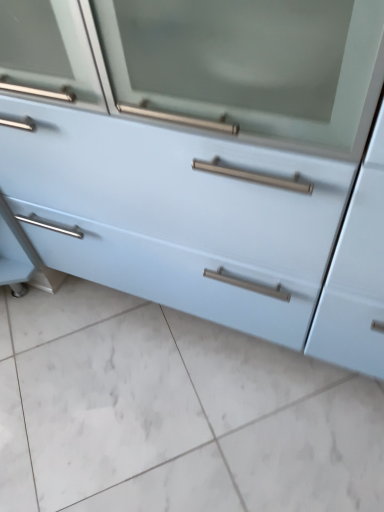
Question: From the image's perspective, relative to white glossy tile at lower center, is light blue matte cabinet at center above or below?

Choices:
 (A) above
 (B) below

Answer: (A)

Question: From a real-world perspective, is light blue matte cabinet at center physically located above or below white glossy tile at lower center?

Choices:
 (A) below
 (B) above

Answer: (B)

Question: Is light blue matte cabinet at center inside or outside of white glossy tile at lower center?

Choices:
 (A) inside
 (B) outside

Answer: (B)

Question: From a real-world perspective, is white glossy tile at lower center physically located above or below light blue matte cabinet at center?

Choices:
 (A) below
 (B) above

Answer: (A)

Question: Which is correct: white glossy tile at lower center is inside light blue matte cabinet at center, or outside of it?

Choices:
 (A) inside
 (B) outside

Answer: (B)

Question: Is white glossy tile at lower center to the left or to the right of light blue matte cabinet at center in the image?

Choices:
 (A) left
 (B) right

Answer: (A)

Question: In terms of size, does white glossy tile at lower center appear bigger or smaller than light blue matte cabinet at center?

Choices:
 (A) big
 (B) small

Answer: (B)